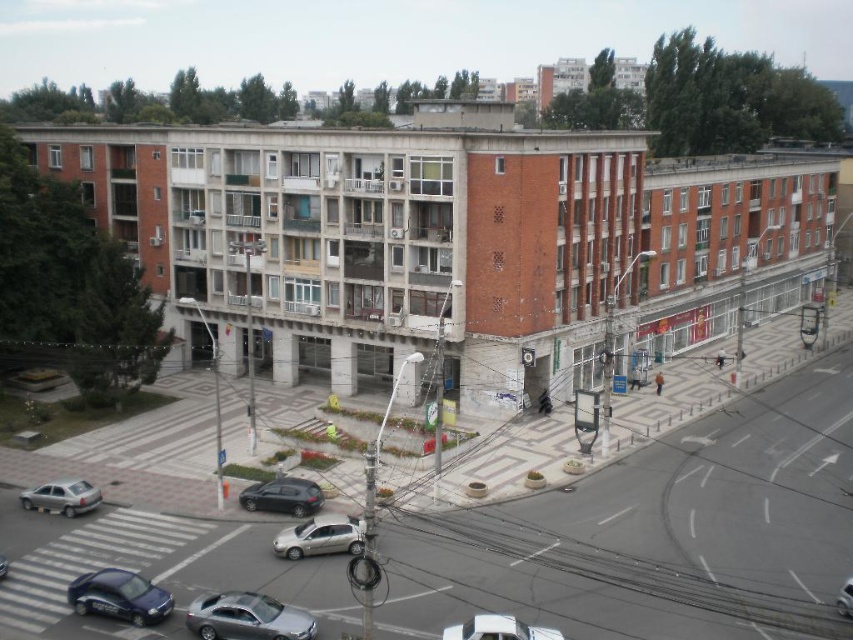
Is point (109, 589) farther from viewer compared to point (840, 596)?

No, (109, 589) is closer to viewer.

The image size is (853, 640). I want to click on metallic blue sedan at lower left, so click(119, 596).

This screenshot has width=853, height=640. I want to click on metallic blue sedan at lower left, so click(x=119, y=596).

What do you see at coordinates (247, 618) in the screenshot?
I see `sleek silver sedan at lower center` at bounding box center [247, 618].

Which is behind, point (212, 628) or point (309, 518)?

The point (309, 518) is behind.

Does point (218, 628) lie in front of point (283, 547)?

Yes.

The height and width of the screenshot is (640, 853). I want to click on sleek silver sedan at lower center, so click(x=247, y=618).

Can you confirm if shiny silver car at lower center is positioned to the left of metallic silver car at center?

Indeed, shiny silver car at lower center is positioned on the left side of metallic silver car at center.

Between shiny silver car at lower center and metallic silver car at center, which one is positioned lower?

shiny silver car at lower center is below.

Locate an element on the screen. shiny silver car at lower center is located at coordinates (497, 628).

Where is `shiny silver car at lower center`? This screenshot has width=853, height=640. shiny silver car at lower center is located at coordinates (497, 628).